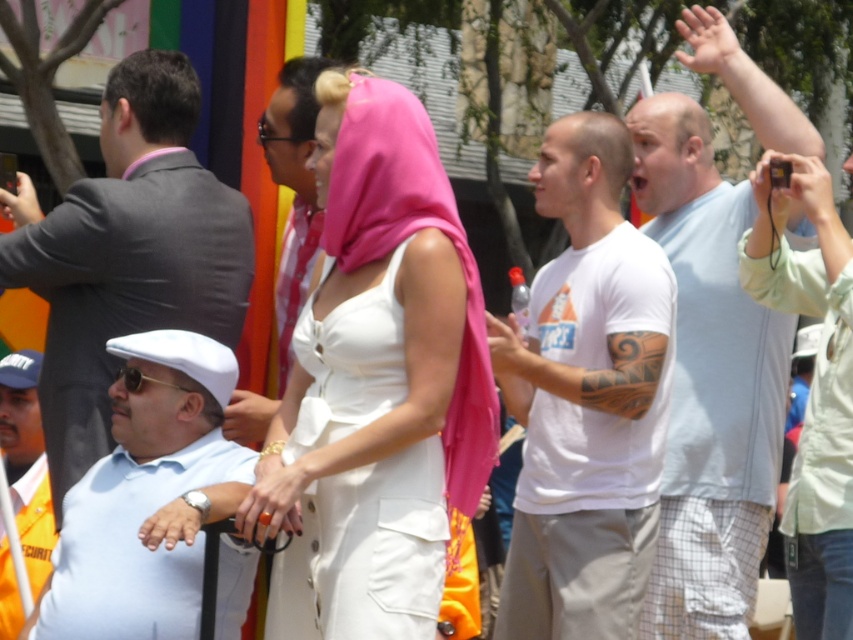
This screenshot has width=853, height=640. What do you see at coordinates (395, 349) in the screenshot?
I see `matte white dress at center` at bounding box center [395, 349].

Which is behind, point (306, 385) or point (111, 456)?

Positioned behind is point (306, 385).

I want to click on matte white dress at center, so click(395, 349).

This screenshot has width=853, height=640. In order to click on matte white dress at center in this screenshot , I will do `click(395, 349)`.

Is point (669, 330) positioned behind point (500, 328)?

Yes, it is behind point (500, 328).

Which is below, white cotton t-shirt at center or white matte bottle at center?

white cotton t-shirt at center

Which is in front, point (654, 509) or point (509, 339)?

Point (509, 339) is in front.

Identify the location of white cotton t-shirt at center. (589, 400).

Who is taller, white cotton t-shirt at center or white matte shirt at center?

Standing taller between the two is white cotton t-shirt at center.

The image size is (853, 640). Identify the location of white cotton t-shirt at center. (589, 400).

Is point (582, 486) more distant than point (80, 608)?

Yes.

In order to click on white cotton t-shirt at center in this screenshot , I will do `click(589, 400)`.